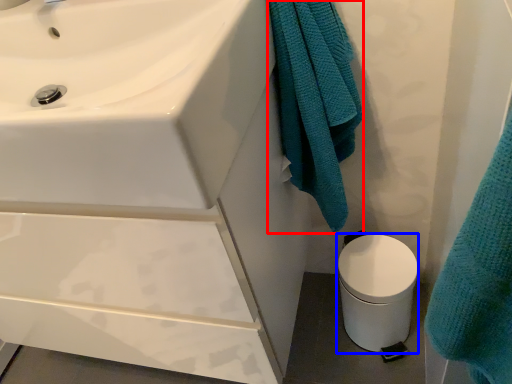
Question: Which object is closer to the camera taking this photo, bath towel (highlighted by a red box) or toilet bowl (highlighted by a blue box)?

Choices:
 (A) bath towel
 (B) toilet bowl

Answer: (A)